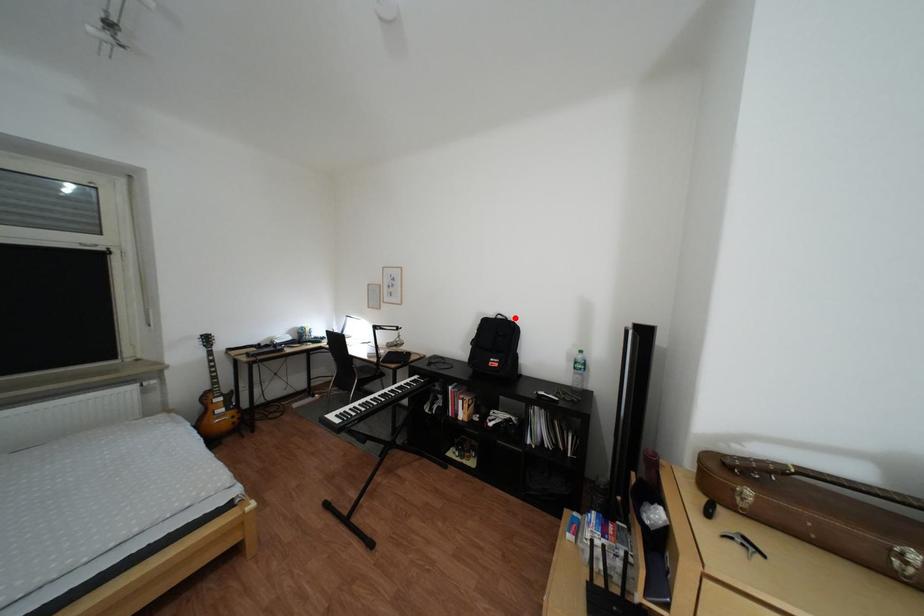
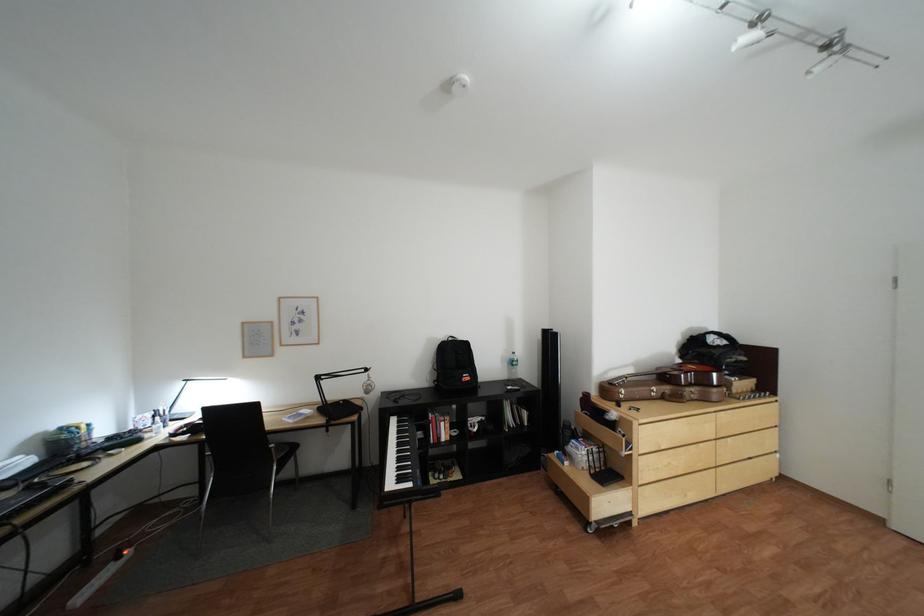
Where in the second image is the point corresponding to the highlighted location from the first image?

(466, 339)